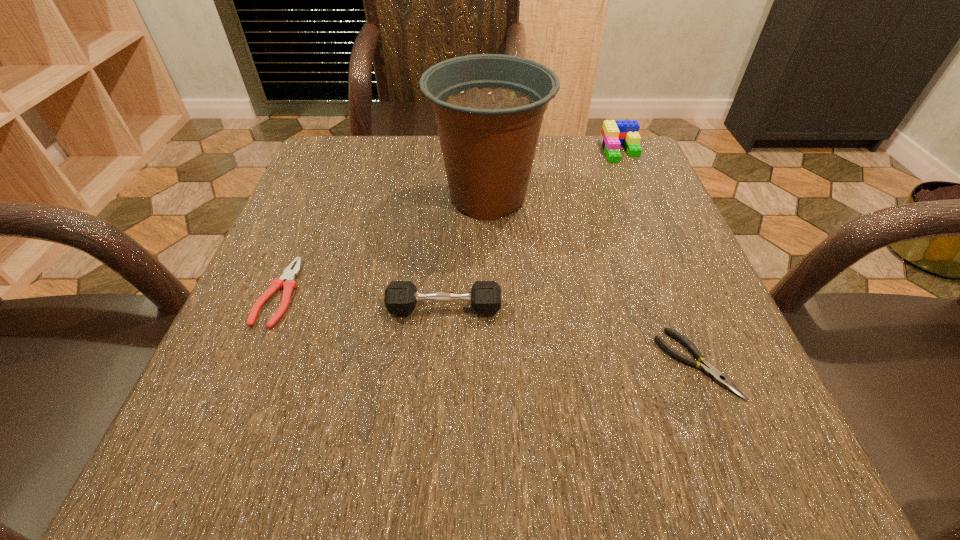
Image resolution: width=960 pixels, height=540 pixels. I want to click on vacant space located on the back of the dumbbell, so click(446, 275).

Where is `vacant space situated 0.400m on the right of the left pliers`? The width and height of the screenshot is (960, 540). vacant space situated 0.400m on the right of the left pliers is located at coordinates (538, 293).

This screenshot has width=960, height=540. What are the coordinates of `free location located on the left of the nearest object` in the screenshot? It's located at (392, 364).

Identify the location of flowerpot that is at the far edge. This screenshot has width=960, height=540. (489, 108).

You are a GUI agent. You are given a task and a screenshot of the screen. Output one action in this format:
    pyautogui.click(x=<x>, y=<y>)
    Task: Click on the Lego situated at the far edge
    This screenshot has width=960, height=540.
    Given the screenshot: What is the action you would take?
    pyautogui.click(x=614, y=133)

Identify the location of object present at the left edge. (287, 281).

Find the location of a particular element. Lego located in the right edge section of the desktop is located at coordinates (614, 133).

Locate an element on the screen. pliers located at the right edge is located at coordinates (709, 370).

This screenshot has height=540, width=960. I want to click on object at the far right corner, so click(614, 133).

Identify the location of vacant space at the far edge of the desktop. The height and width of the screenshot is (540, 960). (561, 139).